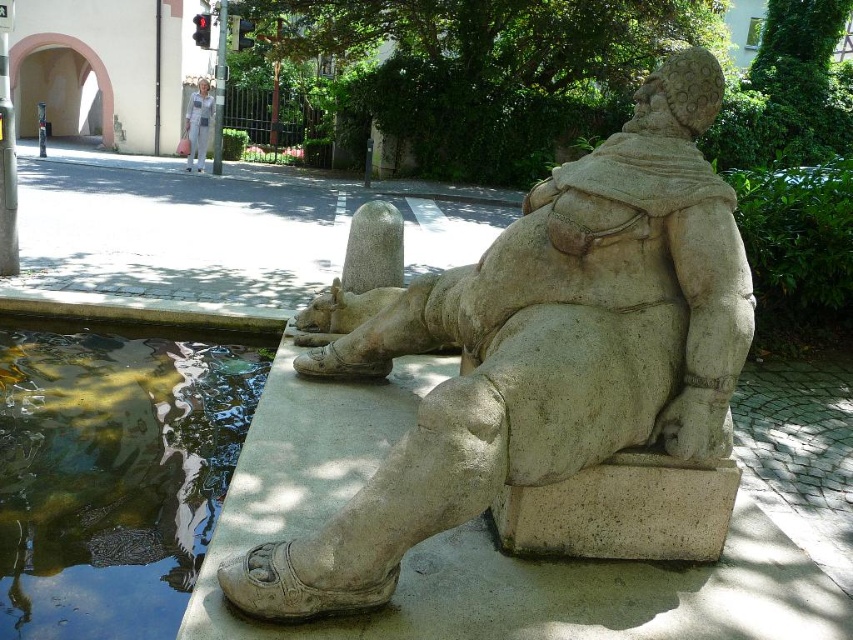
Is stone statue at center wider than clear glass pool at lower left?

No.

Which is behind, point (624, 368) or point (107, 387)?

The point (107, 387) is more distant.

What are the coordinates of `stone statue at center` in the screenshot? It's located at (543, 349).

Is point (91, 348) farther from viewer compared to point (198, 138)?

No, it is not.

Who is more forward, (163, 374) or (196, 92)?

Point (163, 374) is in front.

Find the location of a particular element. The height and width of the screenshot is (640, 853). clear glass pool at lower left is located at coordinates (113, 468).

Is the position of stone statue at center more distant than that of white fabric pants at center?

No, stone statue at center is in front of white fabric pants at center.

How far apart are stone statue at center and white fabric pants at center?

stone statue at center is 15.65 meters away from white fabric pants at center.

Which is behind, point (566, 358) or point (189, 118)?

Point (189, 118)

Identify the location of stone statue at center. Image resolution: width=853 pixels, height=640 pixels. point(543,349).